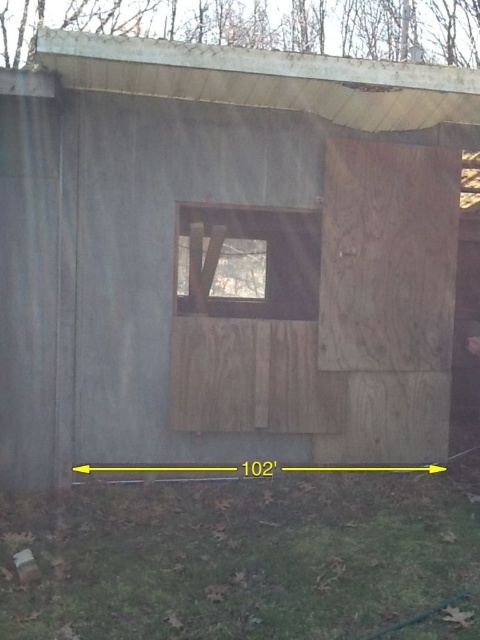
Between weathered wood hut at center and transparent glass window at center, which one has less height?

With less height is transparent glass window at center.

Which is more to the left, weathered wood hut at center or transparent glass window at center?

Positioned to the left is transparent glass window at center.

Describe the element at coordinates (226, 256) in the screenshot. This screenshot has height=640, width=480. I see `weathered wood hut at center` at that location.

Locate an element on the screen. This screenshot has width=480, height=640. weathered wood hut at center is located at coordinates (226, 256).